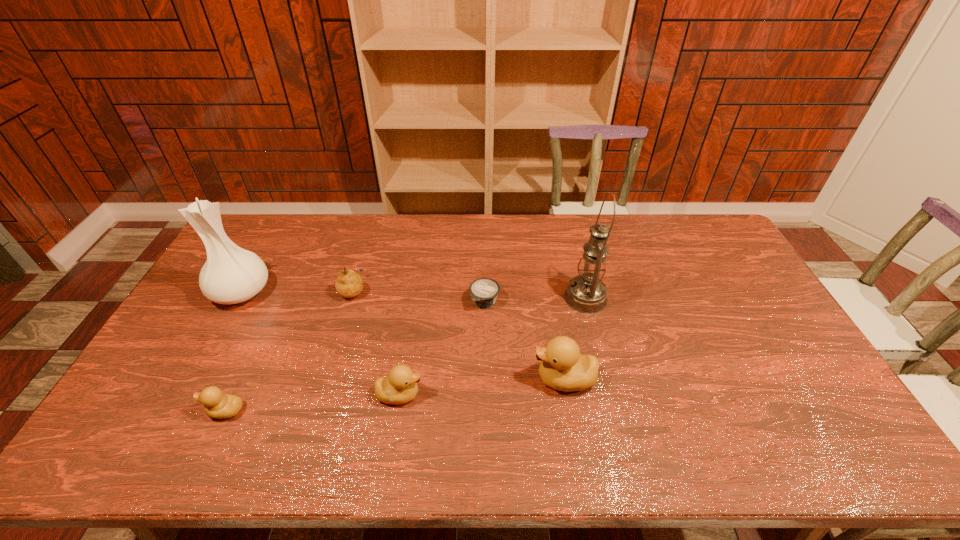
Locate an element on the screen. This screenshot has height=540, width=960. vacant space in between the pear and the fifth shortest object is located at coordinates (459, 334).

The height and width of the screenshot is (540, 960). Identify the location of unoccupied area between the second shortest duckling and the fifth object from right to left. (376, 342).

You are a GUI agent. You are given a task and a screenshot of the screen. Output one action in this format:
    pyautogui.click(x=<x>, y=<y>)
    Task: Click on the empty space between the vase and the yogurt
    The width and height of the screenshot is (960, 540).
    Given the screenshot: What is the action you would take?
    pyautogui.click(x=363, y=296)

You are a GUI agent. You are given a task and a screenshot of the screen. Output one action in this format:
    pyautogui.click(x=<x>, y=<y>)
    Task: Click on the free area in between the shortest duckling and the second duckling from right to left
    Image resolution: width=960 pixels, height=540 pixels.
    Given the screenshot: What is the action you would take?
    pyautogui.click(x=312, y=402)

Locate an element on the screen. free point between the fifth object from right to left and the third tallest object is located at coordinates (459, 334).

Locate which object ranks second in proximity to the oil lamp. Please provide its 2D coordinates. Your answer should be formatted as a tuple, i.e. [(x, y)], where the tuple contains the x and y coordinates of a point satisfying the conditions above.

[(484, 291)]

Select which object is the sixth closest to the fifth object from left to right. Please provide its 2D coordinates. Your answer should be formatted as a tuple, i.e. [(x, y)], where the tuple contains the x and y coordinates of a point satisfying the conditions above.

[(231, 274)]

Identify which duckling is the second closest to the rightmost duckling. Please provide its 2D coordinates. Your answer should be formatted as a tuple, i.e. [(x, y)], where the tuple contains the x and y coordinates of a point satisfying the conditions above.

[(216, 404)]

Locate which duckling is the second closest to the fifth object from right to left. Please provide its 2D coordinates. Your answer should be formatted as a tuple, i.e. [(x, y)], where the tuple contains the x and y coordinates of a point satisfying the conditions above.

[(216, 404)]

Locate an element on the screen. The width and height of the screenshot is (960, 540). vacant space that satisfies the following two spatial constraints: 1. on the back side of the oil lamp; 2. on the right side of the fifth object from left to right is located at coordinates (485, 298).